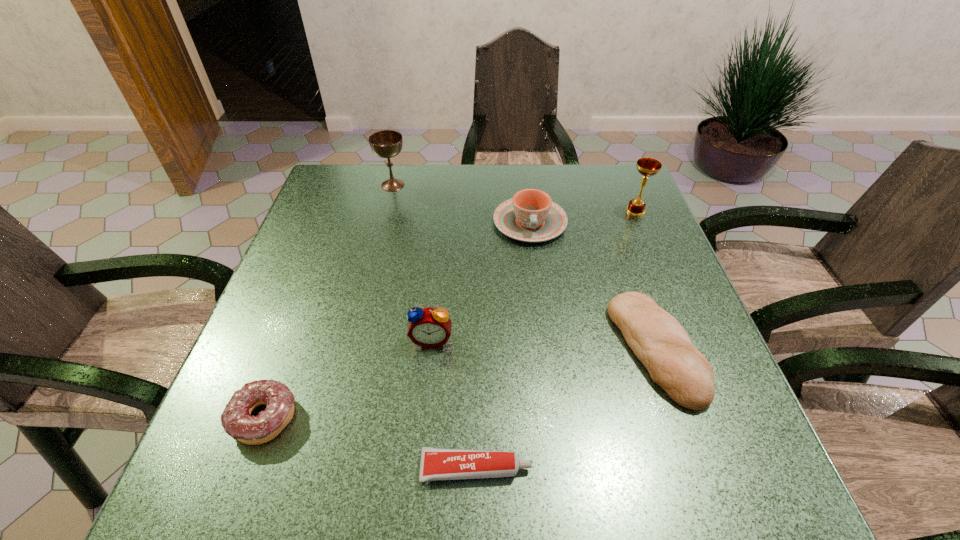
Identify the location of doughnut situated at the left edge. The width and height of the screenshot is (960, 540). (236, 419).

Locate an element on the screen. The height and width of the screenshot is (540, 960). chalice at the right edge is located at coordinates 647,167.

This screenshot has height=540, width=960. Find the location of `bread that is at the right edge`. bread that is at the right edge is located at coordinates (657, 339).

Find the location of a particular element. The width and height of the screenshot is (960, 540). object that is at the far left corner is located at coordinates (386, 144).

Find the location of a particular element. object present at the far right corner is located at coordinates (647, 167).

What are the coordinates of `free space at the far edge of the desktop` in the screenshot? It's located at (407, 192).

Locate an element on the screen. This screenshot has width=960, height=540. vacant space at the near edge of the desktop is located at coordinates pyautogui.click(x=589, y=476).

The image size is (960, 540). In order to click on vacant area at the left edge of the desktop in this screenshot , I will do `click(235, 382)`.

In the image, there is a desktop. Where is `vacant space at the right edge`? vacant space at the right edge is located at coordinates (609, 263).

The height and width of the screenshot is (540, 960). Find the location of `free location at the far left corner`. free location at the far left corner is located at coordinates (346, 171).